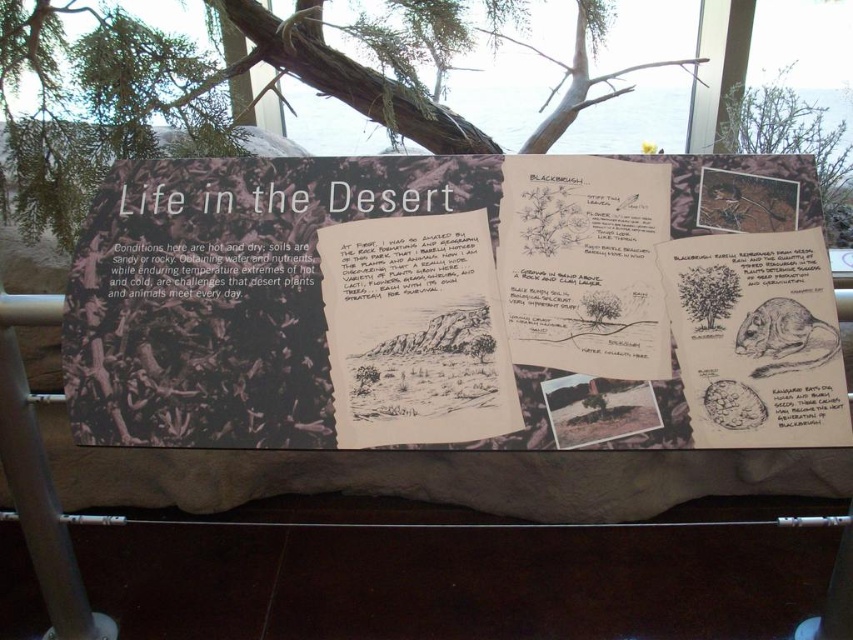
Consider the image. Which object is positioned higher in the image, the matte black signboard at center or the brown paper sketch at center right?

The matte black signboard at center is positioned higher than the brown paper sketch at center right.